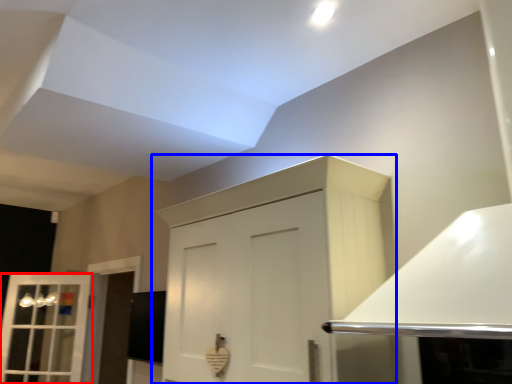
Question: Which of the following is the farthest to the observer, window (highlighted by a red box) or cabinetry (highlighted by a blue box)?

Choices:
 (A) window
 (B) cabinetry

Answer: (A)